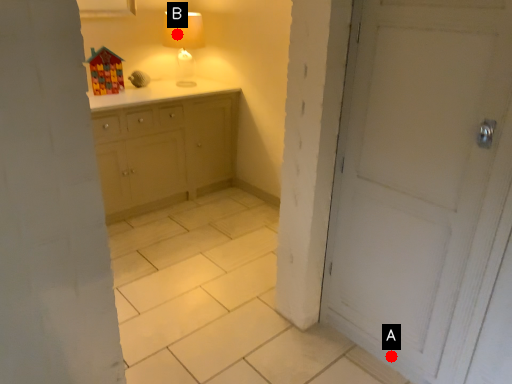
Question: Two points are circled on the image, labeled by A and B beside each circle. Which point is further to the camera?

Choices:
 (A) A is further
 (B) B is further

Answer: (B)